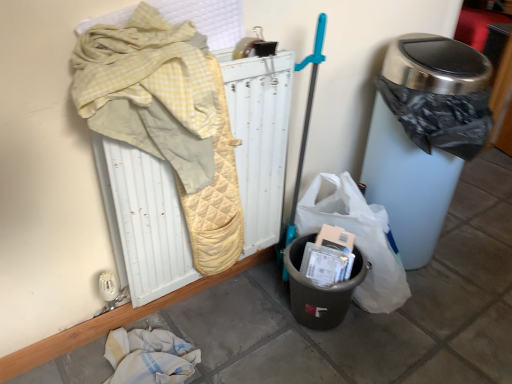
Question: Is black plastic recycling bin at lower center with metallic trash can at right?

Choices:
 (A) no
 (B) yes

Answer: (A)

Question: Is black plastic recycling bin at lower center oriented away from metallic trash can at right?

Choices:
 (A) no
 (B) yes

Answer: (A)

Question: Can you confirm if black plastic recycling bin at lower center is positioned to the right of metallic trash can at right?

Choices:
 (A) no
 (B) yes

Answer: (A)

Question: Is black plastic recycling bin at lower center bigger than metallic trash can at right?

Choices:
 (A) yes
 (B) no

Answer: (B)

Question: Is black plastic recycling bin at lower center far from metallic trash can at right?

Choices:
 (A) yes
 (B) no

Answer: (B)

Question: From a real-world perspective, is black plastic recycling bin at lower center on metallic trash can at right?

Choices:
 (A) no
 (B) yes

Answer: (A)

Question: Is black plastic recycling bin at lower center smaller than yellow quilted radiator at upper left?

Choices:
 (A) no
 (B) yes

Answer: (B)

Question: Is black plastic recycling bin at lower center positioned with its back to yellow quilted radiator at upper left?

Choices:
 (A) no
 (B) yes

Answer: (A)

Question: Does black plastic recycling bin at lower center have a greater width compared to yellow quilted radiator at upper left?

Choices:
 (A) no
 (B) yes

Answer: (B)

Question: Considering the relative positions of black plastic recycling bin at lower center and yellow quilted radiator at upper left in the image provided, is black plastic recycling bin at lower center in front of yellow quilted radiator at upper left?

Choices:
 (A) yes
 (B) no

Answer: (B)

Question: Is black plastic recycling bin at lower center completely or partially outside of yellow quilted radiator at upper left?

Choices:
 (A) yes
 (B) no

Answer: (A)

Question: Can you confirm if black plastic recycling bin at lower center is bigger than yellow quilted radiator at upper left?

Choices:
 (A) yes
 (B) no

Answer: (B)

Question: Does metallic trash can at right have a lesser height compared to black plastic recycling bin at lower center?

Choices:
 (A) no
 (B) yes

Answer: (A)